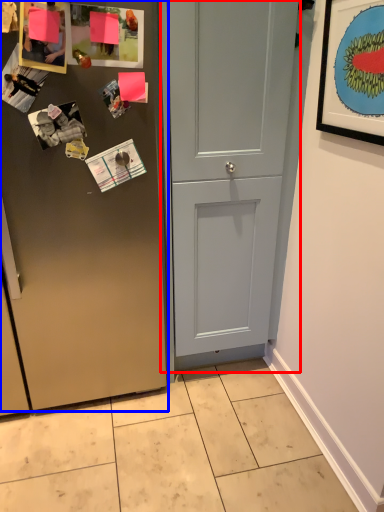
Question: Which of the following is the farthest to the observer, door (highlighted by a red box) or door (highlighted by a blue box)?

Choices:
 (A) door
 (B) door

Answer: (A)